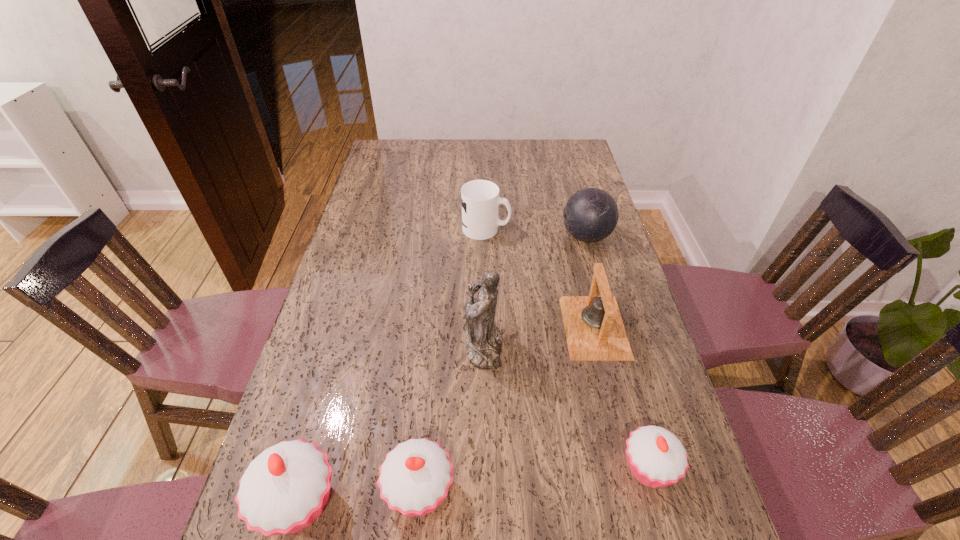
Where is `the second tallest cupcake`? the second tallest cupcake is located at coordinates (415, 477).

This screenshot has height=540, width=960. I want to click on the rightmost cupcake, so click(x=656, y=457).

You are a GUI agent. You are given a task and a screenshot of the screen. Output one action in this format:
    pyautogui.click(x=<x>, y=<y>)
    Task: Click on the shortest object
    The height and width of the screenshot is (540, 960).
    Given the screenshot: What is the action you would take?
    pyautogui.click(x=656, y=457)

You are a GUI agent. You are given a task and a screenshot of the screen. Output one action in this format:
    pyautogui.click(x=<x>, y=<y>)
    Task: Click on the mug
    
    Given the screenshot: What is the action you would take?
    (480, 199)

The width and height of the screenshot is (960, 540). What are the coordinates of `bell` in the screenshot? It's located at (594, 329).

You are a GUI agent. You are given a task and a screenshot of the screen. Output one action in this format:
    pyautogui.click(x=<x>, y=<y>)
    Task: Click on the bowling ball
    
    Given the screenshot: What is the action you would take?
    (591, 214)

Find the location of a particular element. Image resolution: width=960 pixels, height=540 pixels. figurine is located at coordinates (483, 340).

The image size is (960, 540). Identify the location of vacant space located 0.250m on the back of the second shortest cupcake. [432, 359].

Where is `free location located 0.240m on the back of the shortest object`? This screenshot has height=540, width=960. free location located 0.240m on the back of the shortest object is located at coordinates (616, 351).

I want to click on blank space located on the handle side of the mug, so click(607, 228).